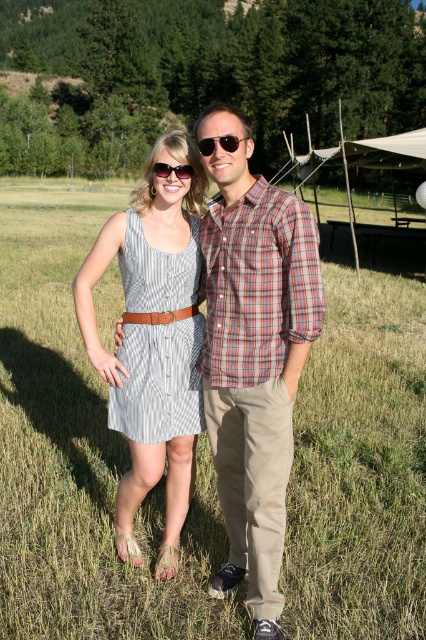
You are a photographer setting up for a group photo. You need to ensure that the striped cotton dress at center and the matte black sunglasses at center are both visible in the frame. Based on their sizes, which object should you focus on to ensure both are in focus?

The striped cotton dress at center is taller than the matte black sunglasses at center, so focusing on the taller object, the striped cotton dress at center, will ensure both are in focus.

You are a photographer setting up a shot of the striped cotton dress at center and the matte black sunglasses at center. To ensure both are in focus, you need to know their vertical positions. Which object is placed lower in the image?

The striped cotton dress at center is placed lower than the matte black sunglasses at center in the image.

Consider the image. You are a photographer setting up a shoot in the grassy field. You have a striped cotton dress at center and matte black sunglasses at center in your frame. Which object will appear bigger in your camera viewfinder?

The striped cotton dress at center will appear bigger in the camera viewfinder because it is larger in size than the matte black sunglasses at center.